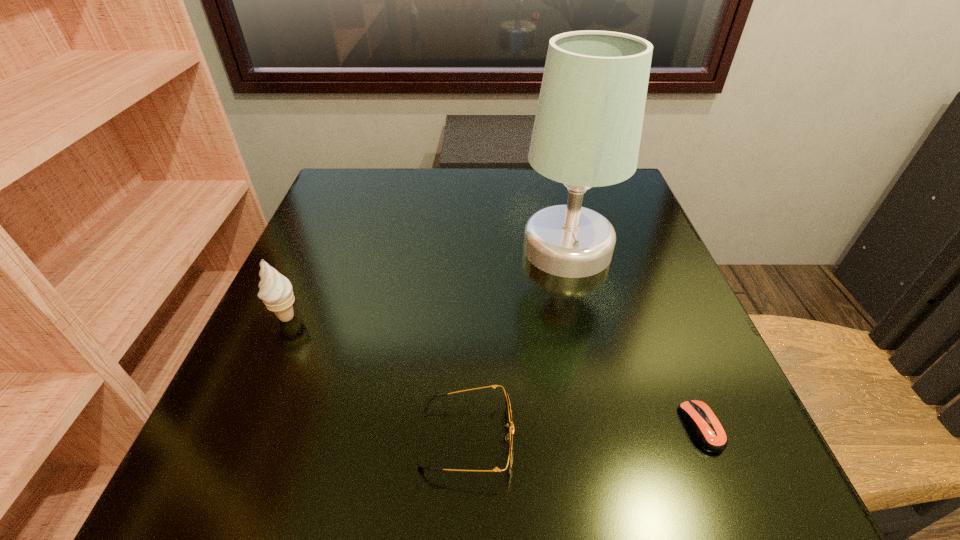
Locate an element on the screen. This screenshot has height=540, width=960. vacant space at the far edge is located at coordinates (420, 176).

Where is `free space at the near edge of the desktop`? The width and height of the screenshot is (960, 540). free space at the near edge of the desktop is located at coordinates (331, 472).

Locate an element on the screen. Image resolution: width=960 pixels, height=540 pixels. vacant position at the left edge of the desktop is located at coordinates (259, 342).

At what (x,y) coordinates should I click in order to perform the action: click on vacant space at the right edge of the desktop. Please return your answer as a coordinate pair (x, y). Looking at the image, I should click on (679, 299).

Where is `free space at the far left corner of the desktop`? free space at the far left corner of the desktop is located at coordinates (374, 197).

This screenshot has width=960, height=540. What are the coordinates of `vacant space at the far right corner of the desktop` in the screenshot? It's located at (614, 185).

At what (x,y) coordinates should I click in order to perform the action: click on vacant point located between the third nearest object and the lampshade. Please return your answer as a coordinate pair (x, y). This screenshot has height=540, width=960. Looking at the image, I should click on (427, 283).

Locate an element on the screen. This screenshot has width=960, height=540. empty space between the lampshade and the shortest object is located at coordinates (635, 338).

You are a GUI agent. You are given a task and a screenshot of the screen. Output one action in this format:
    pyautogui.click(x=<x>, y=<y>)
    Task: Click on the empty space between the farthest object and the icecream
    
    Given the screenshot: What is the action you would take?
    pyautogui.click(x=427, y=283)

Identify the location of free space between the third tallest object and the rightmost object. The height and width of the screenshot is (540, 960). (584, 433).